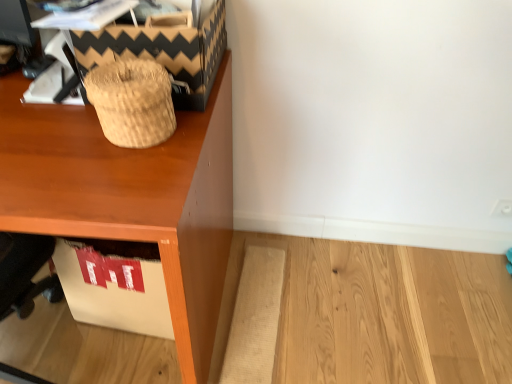
The width and height of the screenshot is (512, 384). Identify the location of free space to the left of woven straw basket at upper left. (50, 136).